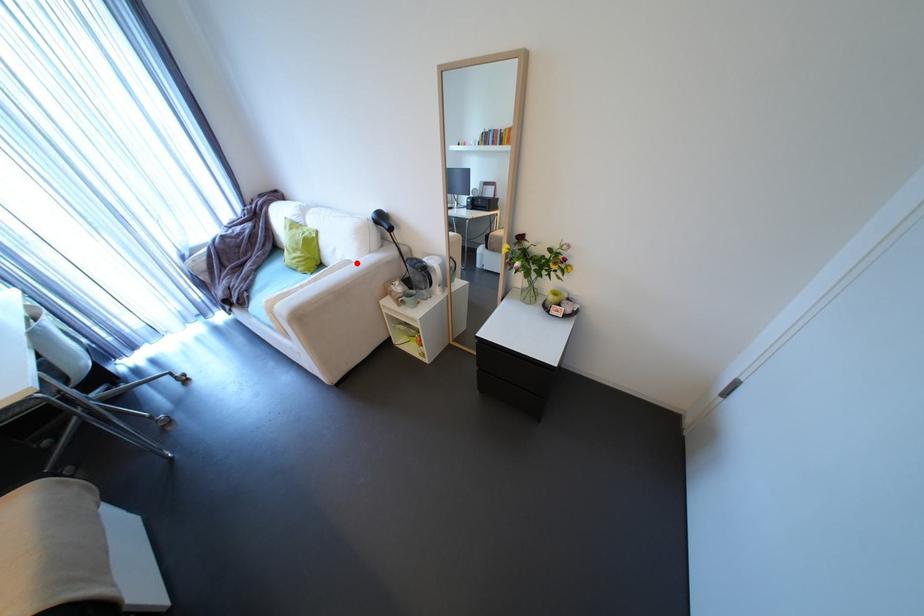
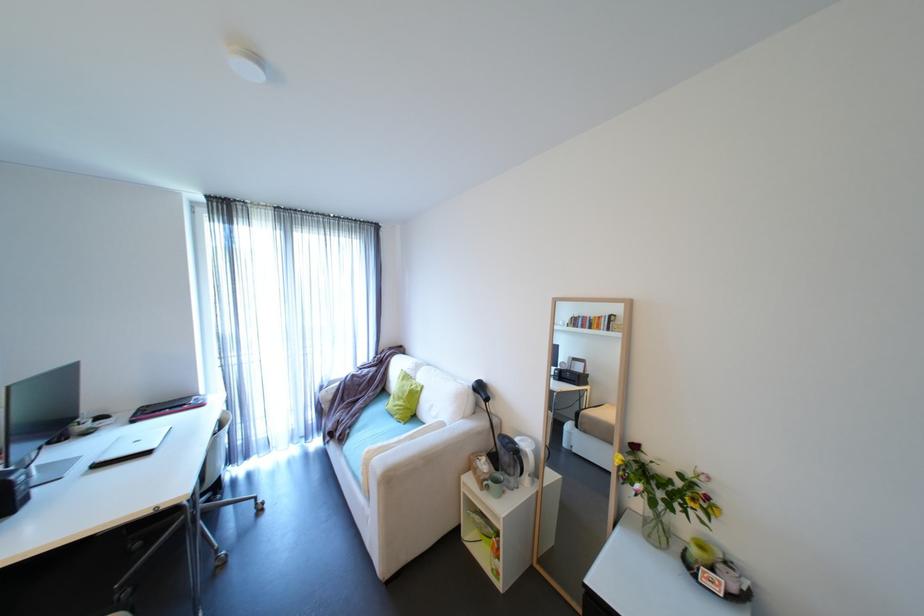
Question: A red point is marked in image1. In image2, is the corresponding 3D point closer to the camera or farther? Reply with the corresponding letter.

Choices:
 (A) The corresponding 3D point is closer.
 (B) The corresponding 3D point is farther.

Answer: (B)